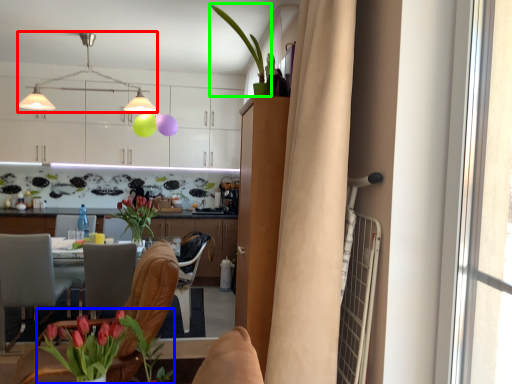
Question: Which object is positioned closest to lamp (highlighted by a red box)? Select from floral arrangement (highlighted by a blue box) and houseplant (highlighted by a green box).

Choices:
 (A) floral arrangement
 (B) houseplant

Answer: (B)